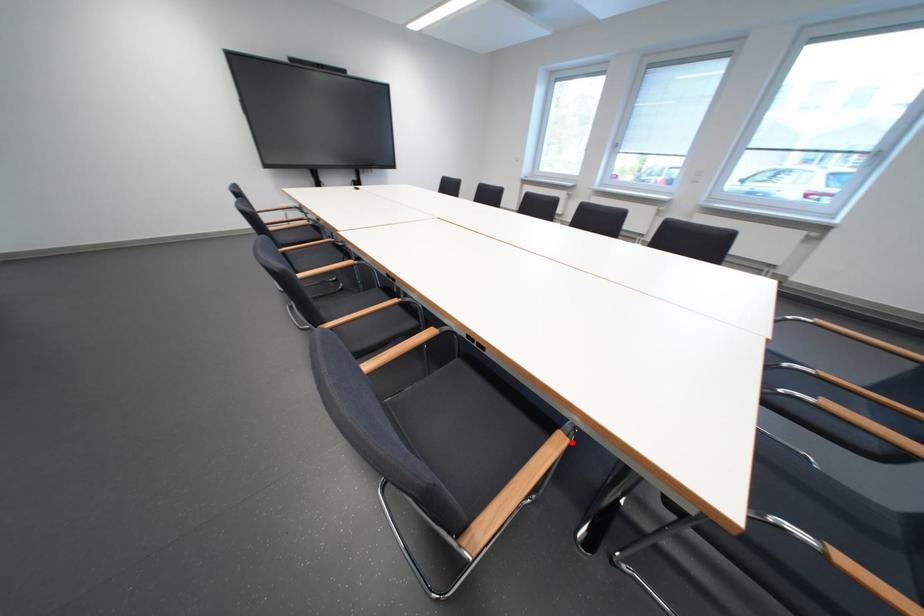
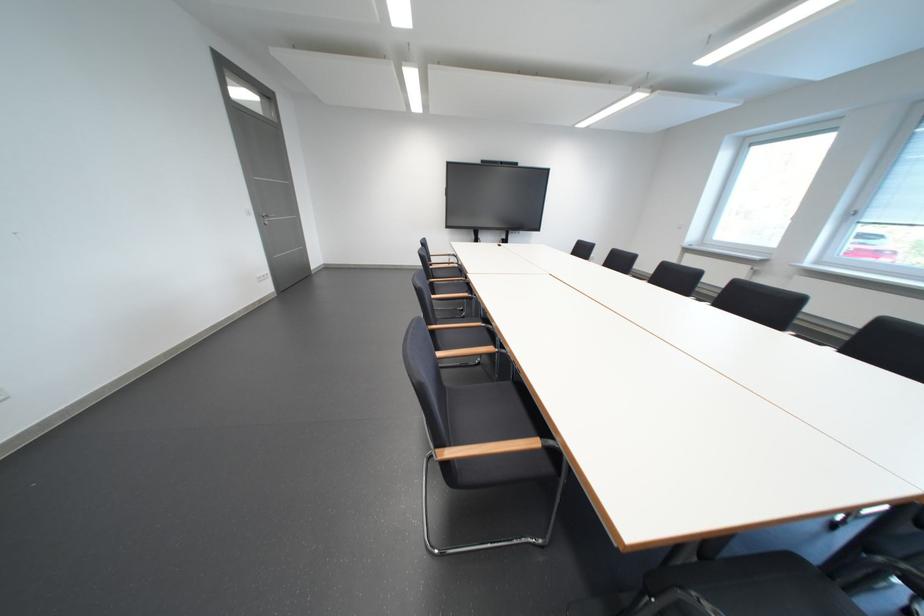
Where in the second image is the point corresponding to the highlighted location from the first image?

(548, 445)